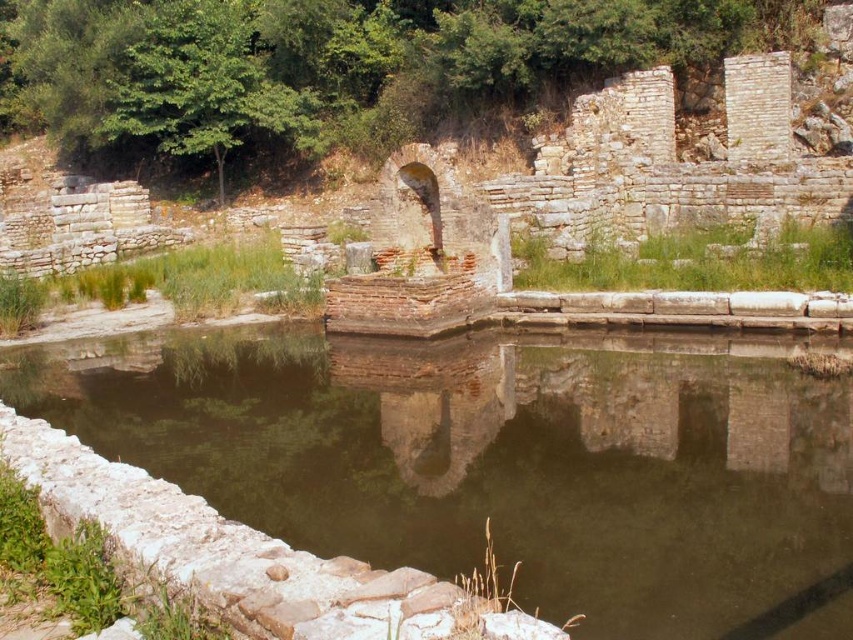
You are standing at the edge of the ancient stone structure and want to reach the smooth stone pool at center. What direction should you move in to get there?

The smooth stone pool at center is located at coordinates point (500, 460), so you should move towards the center of the structure to reach it.

You are standing at the water edge near the low stone wall in the ancient structure. You see two points marked as point 1 and point 2. Point 1 is at coordinates point (573,605) and point 2 is at point (524,632). Which point is closer to you?

Point 2 at point (524,632) is closer to you because point 1 at point (573,605) is behind it.

You are a tour guide leading a group around this ancient site. You want to ensure visitors can walk from the white stone moat at lower left to the smooth stone pool at center without getting their shoes wet. The path between them is 28.61 feet long. If the average person takes 1.5 feet per step, how many steps would they need to take to cross safely?

The distance between the white stone moat at lower left and the smooth stone pool at center is 28.61 feet. At 1.5 feet per step, dividing 28.61 by 1.5 gives approximately 19 steps. So, visitors would need to take around 19 steps to cross safely.